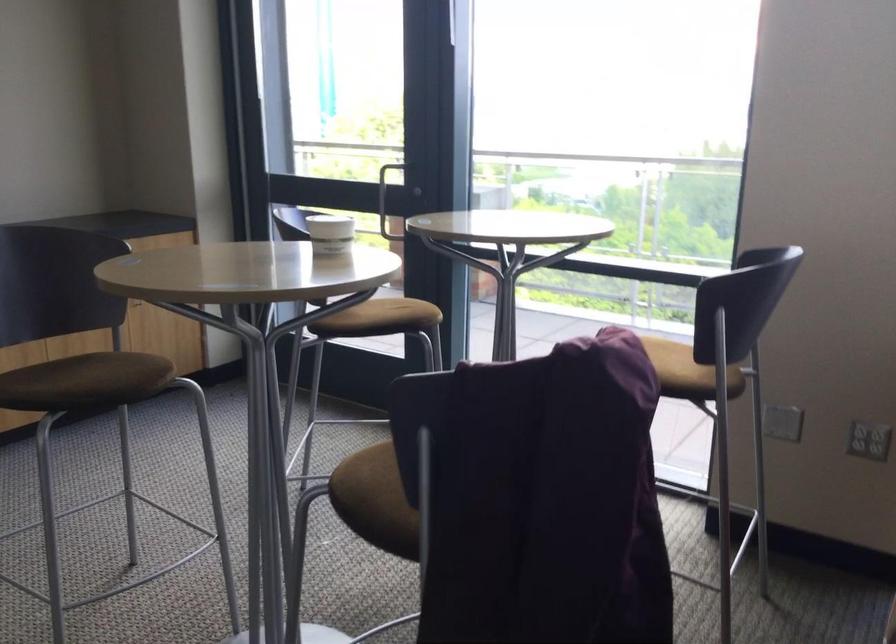
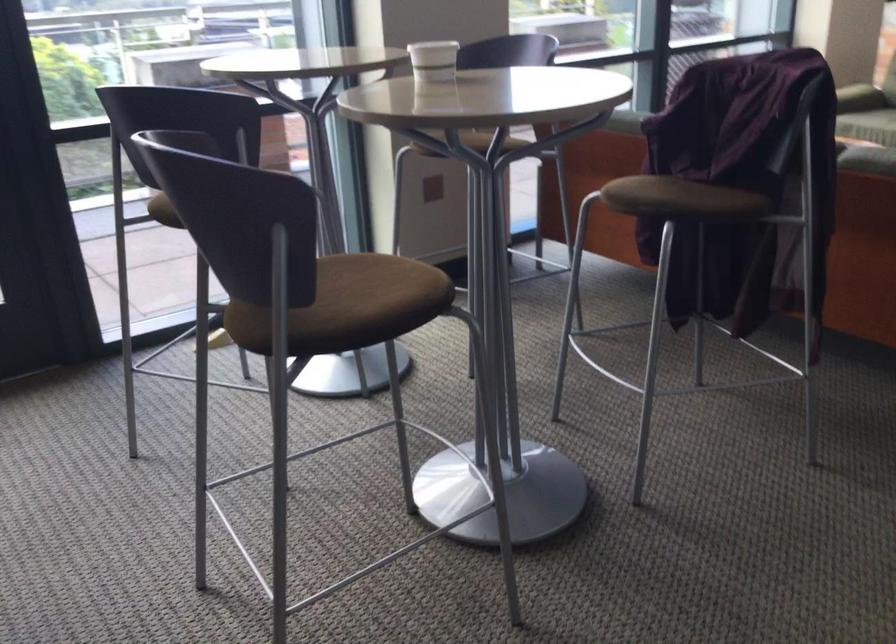
The point at (343, 232) is marked in the first image. Where is the corresponding point in the second image?

(433, 61)